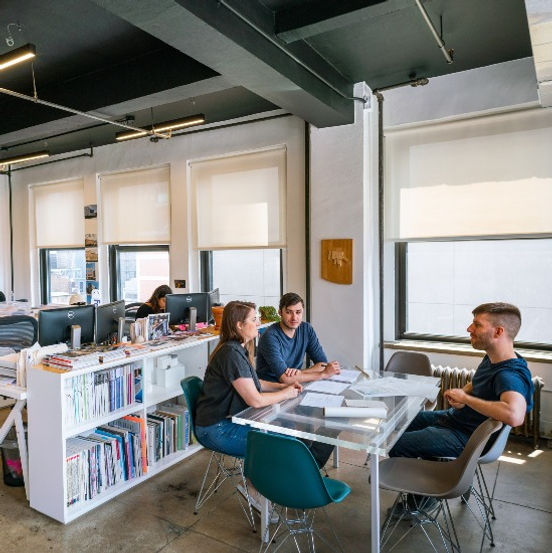
I want to click on blue chairs, so click(x=289, y=495), click(x=187, y=394).